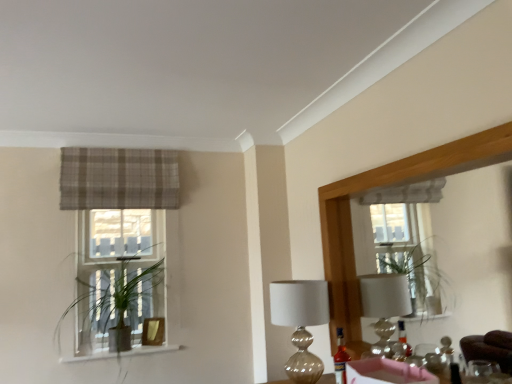
Find the location of a particular element. The width and height of the screenshot is (512, 384). free space above plaid fabric curtain at upper left (from a real-world perspective) is located at coordinates (120, 148).